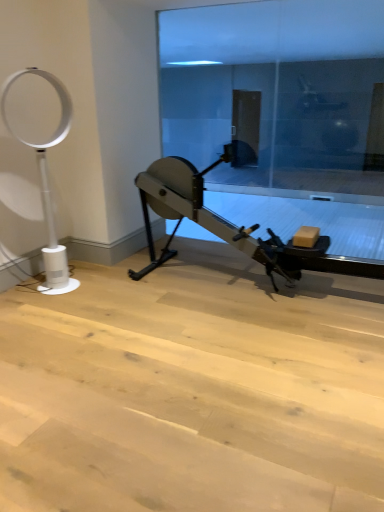
You are a GUI agent. You are given a task and a screenshot of the screen. Output one action in this format:
    pyautogui.click(x=<x>, y=<y>)
    Task: Click on the vacant space to the right of white plastic fan at left
    The height and width of the screenshot is (512, 384).
    Given the screenshot: What is the action you would take?
    pyautogui.click(x=111, y=285)